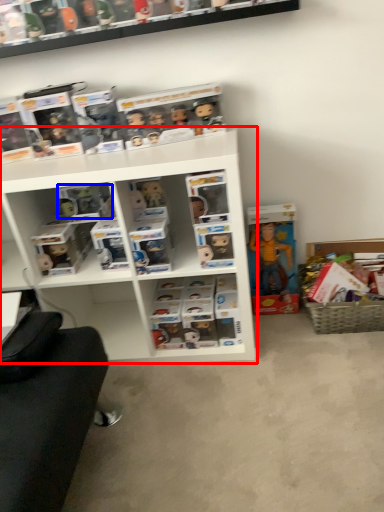
Question: Which point is further to the camera, shelf (highlighted by a red box) or toy (highlighted by a blue box)?

Choices:
 (A) shelf
 (B) toy

Answer: (B)